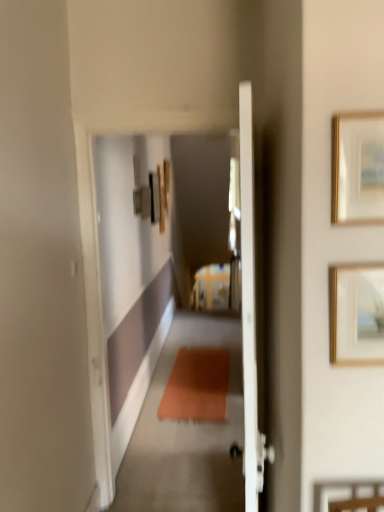
Question: Considering the relative positions of gold metallic picture frame at upper right, placed as the first picture frame when sorted from bottom to top, and gold-framed picture at upper right, the first picture frame when ordered from top to bottom, in the image provided, is gold metallic picture frame at upper right, placed as the first picture frame when sorted from bottom to top, to the left or to the right of gold-framed picture at upper right, the first picture frame when ordered from top to bottom,?

Choices:
 (A) right
 (B) left

Answer: (A)

Question: Which is correct: gold metallic picture frame at upper right, placed as the first picture frame when sorted from bottom to top, is inside gold-framed picture at upper right, the first picture frame when ordered from top to bottom, or outside of it?

Choices:
 (A) outside
 (B) inside

Answer: (A)

Question: Looking at their shapes, would you say gold metallic picture frame at upper right, which ranks as the second picture frame in top-to-bottom order, is wider or thinner than gold-framed picture at upper right, which appears as the 2th picture frame when ordered from the bottom?

Choices:
 (A) wide
 (B) thin

Answer: (A)

Question: In the image, is gold-framed picture at upper right, the first picture frame when ordered from top to bottom, on the left side or the right side of gold metallic picture frame at upper right, placed as the first picture frame when sorted from bottom to top?

Choices:
 (A) right
 (B) left

Answer: (B)

Question: Is gold-framed picture at upper right, the first picture frame when ordered from top to bottom, inside or outside of gold metallic picture frame at upper right, which ranks as the second picture frame in top-to-bottom order?

Choices:
 (A) inside
 (B) outside

Answer: (B)

Question: From the image's perspective, relative to gold metallic picture frame at upper right, which ranks as the second picture frame in top-to-bottom order, is gold-framed picture at upper right, the first picture frame when ordered from top to bottom, above or below?

Choices:
 (A) below
 (B) above

Answer: (B)

Question: From a real-world perspective, relative to gold metallic picture frame at upper right, placed as the first picture frame when sorted from bottom to top, is gold-framed picture at upper right, which appears as the 2th picture frame when ordered from the bottom, vertically above or below?

Choices:
 (A) below
 (B) above

Answer: (B)